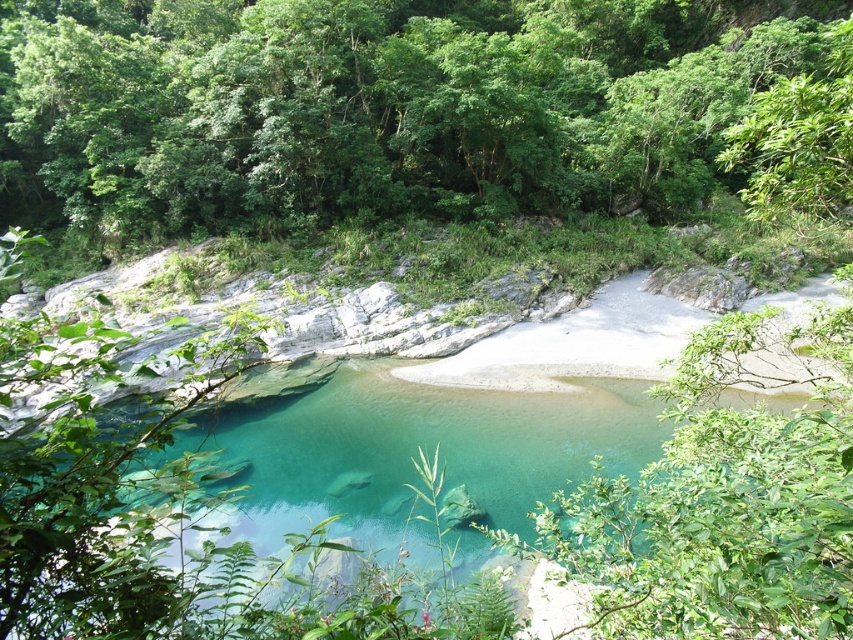
Question: Which point appears farthest from the camera in this image?

Choices:
 (A) (798, 440)
 (B) (345, 161)

Answer: (B)

Question: Which of the following is the farthest from the observer?

Choices:
 (A) green leafy trees at upper center
 (B) clear glassy water at center

Answer: (A)

Question: Which of the following is the closest to the observer?

Choices:
 (A) (16, 221)
 (B) (190, 636)

Answer: (B)

Question: Does green leafy trees at upper center have a larger size compared to clear glassy water at center?

Choices:
 (A) no
 (B) yes

Answer: (B)

Question: Where is green leafy trees at upper center located in relation to clear glassy water at center in the image?

Choices:
 (A) right
 (B) left

Answer: (A)

Question: Can you confirm if green leafy trees at upper center is positioned above clear glassy water at center?

Choices:
 (A) yes
 (B) no

Answer: (A)